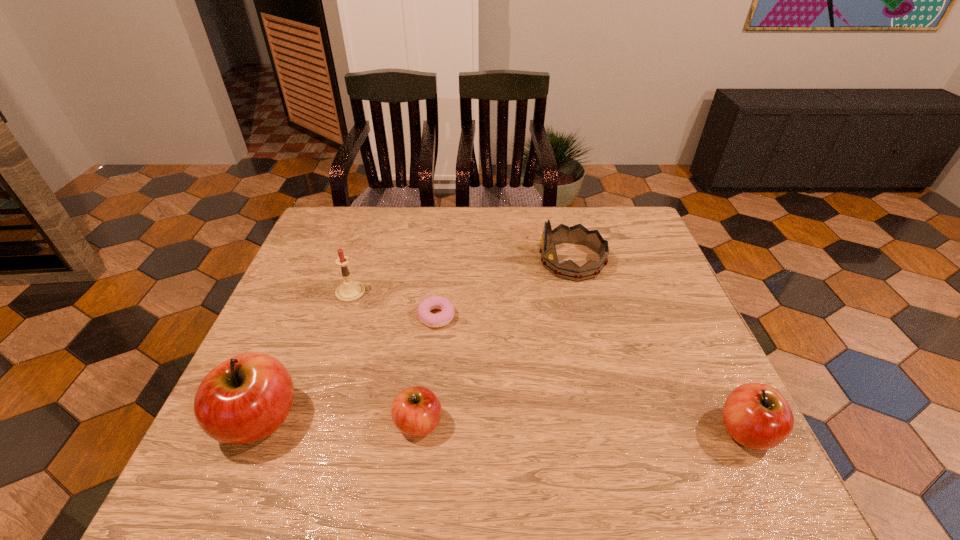
The width and height of the screenshot is (960, 540). What are the coordinates of `object that can be found as the second closest to the candle` in the screenshot? It's located at [246, 398].

Image resolution: width=960 pixels, height=540 pixels. In order to click on apple that is the second closest to the candle in this screenshot , I will do `click(416, 411)`.

Locate an element on the screen. the third closest apple to the tiara is located at coordinates click(x=246, y=398).

The height and width of the screenshot is (540, 960). I want to click on free region that satisfies the following two spatial constraints: 1. at the front of the tiara with jewels; 2. on the front side of the candle, so click(x=580, y=292).

Identify the location of vacant space that satisfies the following two spatial constraints: 1. on the back side of the leftmost apple; 2. on the right side of the candle. (312, 292).